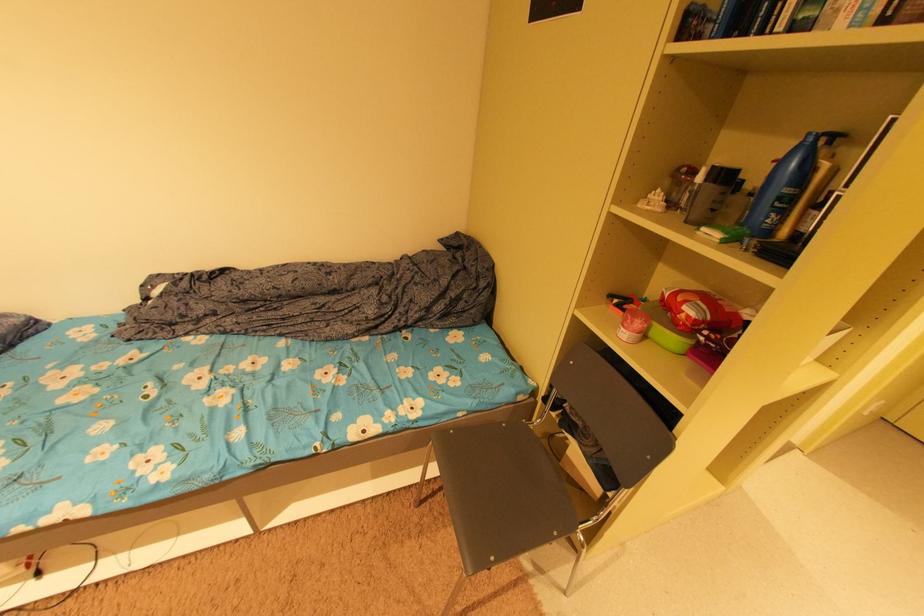
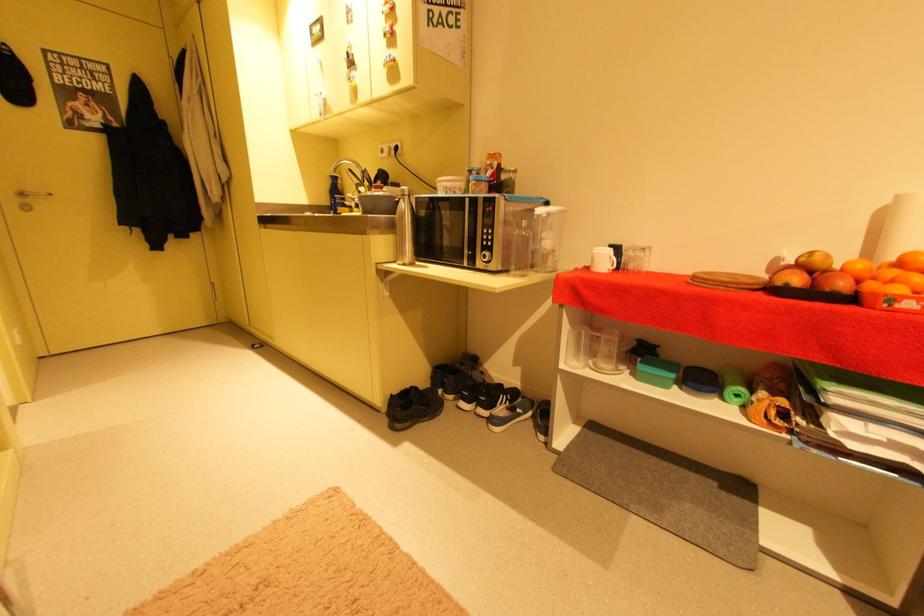
First-person continuous shooting, in which direction is the camera rotating?

The camera rotated toward right-down.